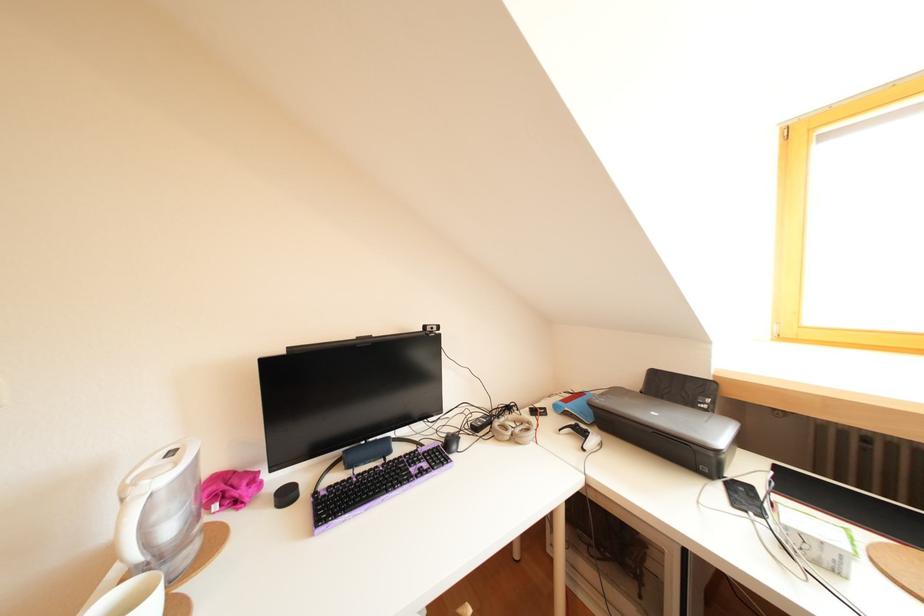
Image resolution: width=924 pixels, height=616 pixels. What do you see at coordinates (131, 535) in the screenshot?
I see `a kettle handle` at bounding box center [131, 535].